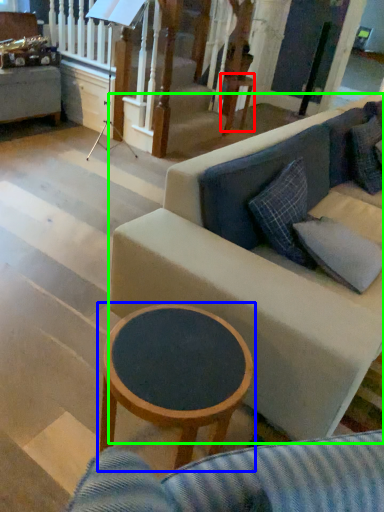
Question: Considering the real-world distances, which object is farthest from table (highlighted by a red box)? coffee table (highlighted by a blue box) or studio couch (highlighted by a green box)?

Choices:
 (A) coffee table
 (B) studio couch

Answer: (A)